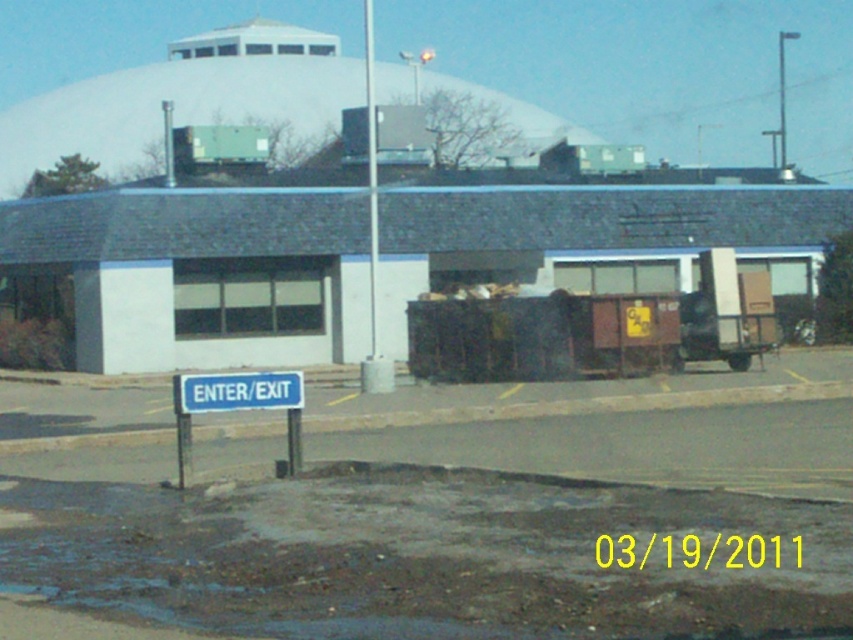
Is blue plastic sign at center below metallic pole at upper center?

Yes.

Does point (195, 394) come behind point (166, 112)?

No, it is not.

The image size is (853, 640). In order to click on blue plastic sign at center in this screenshot , I will do `click(236, 392)`.

How distant is blue plastic sign at lower left from metallic pole at upper center?

A distance of 33.93 meters exists between blue plastic sign at lower left and metallic pole at upper center.

Between point (294, 424) and point (165, 124), which one is positioned behind?

The point (165, 124) is more distant.

Which is in front, point (288, 424) or point (169, 160)?

Positioned in front is point (288, 424).

Where is `blue plastic sign at lower left`? The height and width of the screenshot is (640, 853). blue plastic sign at lower left is located at coordinates (236, 404).

Can you confirm if blue plastic sign at center is positioned above metallic pole at center?

No, blue plastic sign at center is not above metallic pole at center.

Is blue plastic sign at center thinner than metallic pole at center?

Indeed, blue plastic sign at center has a lesser width compared to metallic pole at center.

Is point (183, 410) positioned before point (370, 83)?

Yes, point (183, 410) is closer to viewer.

I want to click on blue plastic sign at center, so (236, 392).